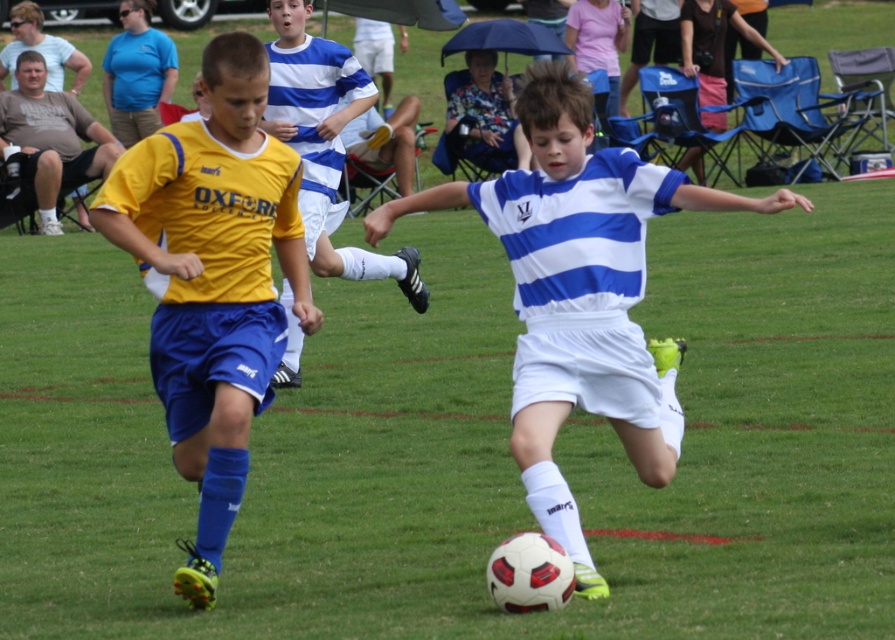
Which of these two, yellow matte jersey at left or blue striped jersey at center, stands shorter?

With less height is yellow matte jersey at left.

Looking at this image, is yellow matte jersey at left wider than blue striped jersey at center?

In fact, yellow matte jersey at left might be narrower than blue striped jersey at center.

Is point (210, 264) positioned after point (359, 276)?

No, it is in front of (359, 276).

The image size is (895, 640). What are the coordinates of `yellow matte jersey at left` in the screenshot? It's located at (212, 280).

Is white matte soccer ball at center above blue striped jersey at center?

Actually, white matte soccer ball at center is below blue striped jersey at center.

Describe the element at coordinates (580, 292) in the screenshot. I see `white matte soccer ball at center` at that location.

At what (x,y) coordinates should I click in order to perform the action: click on white matte soccer ball at center. Please return your answer as a coordinate pair (x, y). The height and width of the screenshot is (640, 895). Looking at the image, I should click on (580, 292).

Which of these two, white matte soccer ball at center or yellow matte jersey at left, stands taller?

yellow matte jersey at left

Which is more to the left, white matte soccer ball at center or yellow matte jersey at left?

yellow matte jersey at left

This screenshot has width=895, height=640. Find the location of `white matte soccer ball at center`. white matte soccer ball at center is located at coordinates (580, 292).